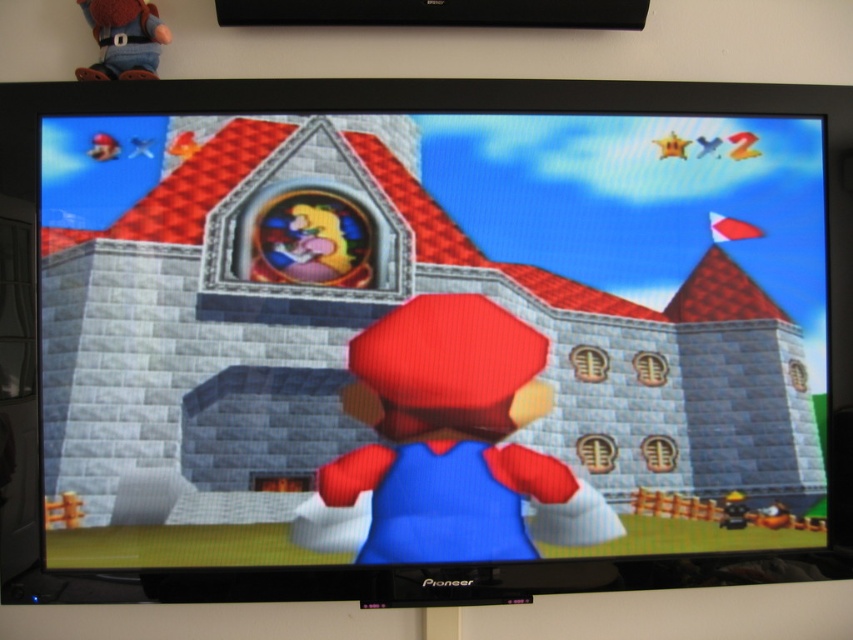
Question: Which object is closer to the camera taking this photo?

Choices:
 (A) matte blue fabric mario at center
 (B) matte blue fabric at center
 (C) black plastic flat at upper center

Answer: (B)

Question: Can you confirm if matte blue fabric mario at center is thinner than matte denim doll at upper left?

Choices:
 (A) no
 (B) yes

Answer: (A)

Question: Does black plastic flat at upper center have a larger size compared to matte denim doll at upper left?

Choices:
 (A) no
 (B) yes

Answer: (B)

Question: Among these objects, which one is farthest from the camera?

Choices:
 (A) black plastic flat at upper center
 (B) matte blue fabric at center
 (C) matte denim doll at upper left
 (D) matte blue fabric mario at center

Answer: (A)

Question: Which object is closer to the camera taking this photo?

Choices:
 (A) black plastic flat at upper center
 (B) matte blue fabric mario at center

Answer: (B)

Question: Can you confirm if matte blue fabric at center is positioned to the right of matte blue fabric mario at center?

Choices:
 (A) yes
 (B) no

Answer: (B)